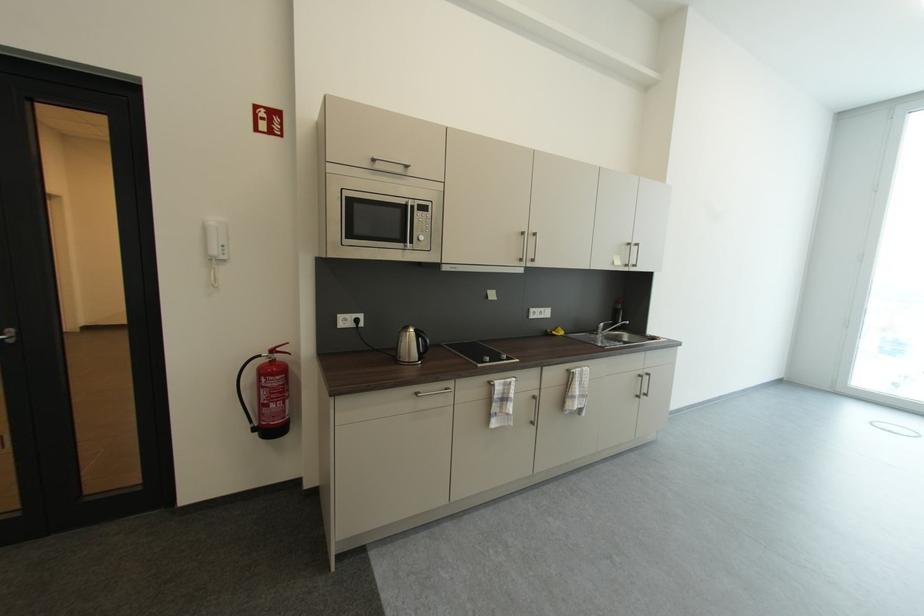
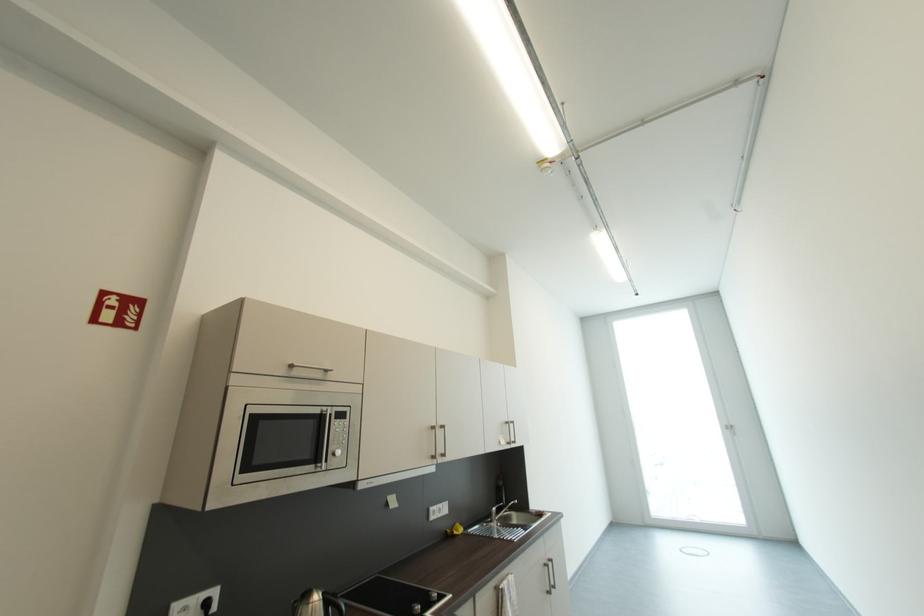
Where in the second image is the point corresponding to (x=636, y=246) from the first image?

(513, 424)